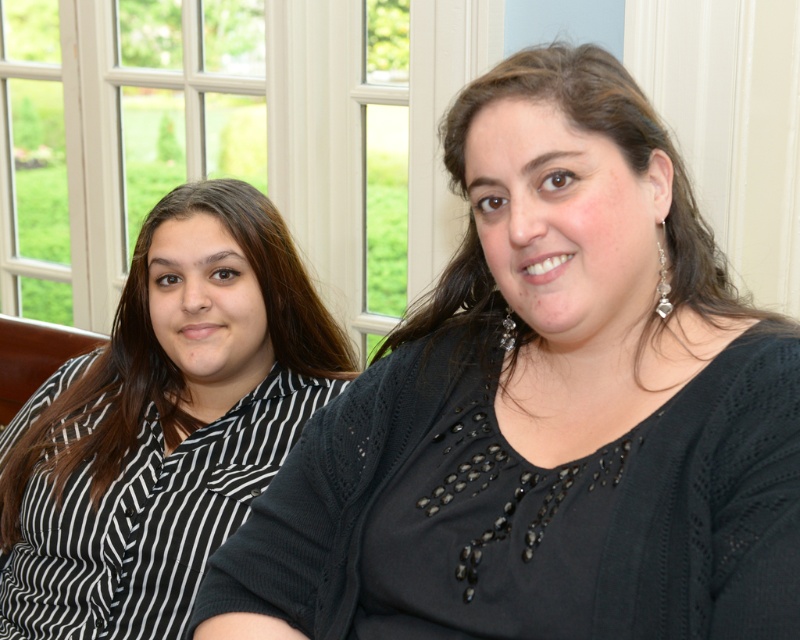
Question: Can you confirm if black knitted sweater at center is positioned below black striped shirt at left?

Choices:
 (A) yes
 (B) no

Answer: (B)

Question: Which of the following is the farthest from the observer?

Choices:
 (A) black striped shirt at left
 (B) black knitted sweater at center

Answer: (A)

Question: Is the position of black knitted sweater at center more distant than that of black striped shirt at left?

Choices:
 (A) no
 (B) yes

Answer: (A)

Question: Can you confirm if black knitted sweater at center is thinner than black striped shirt at left?

Choices:
 (A) yes
 (B) no

Answer: (B)